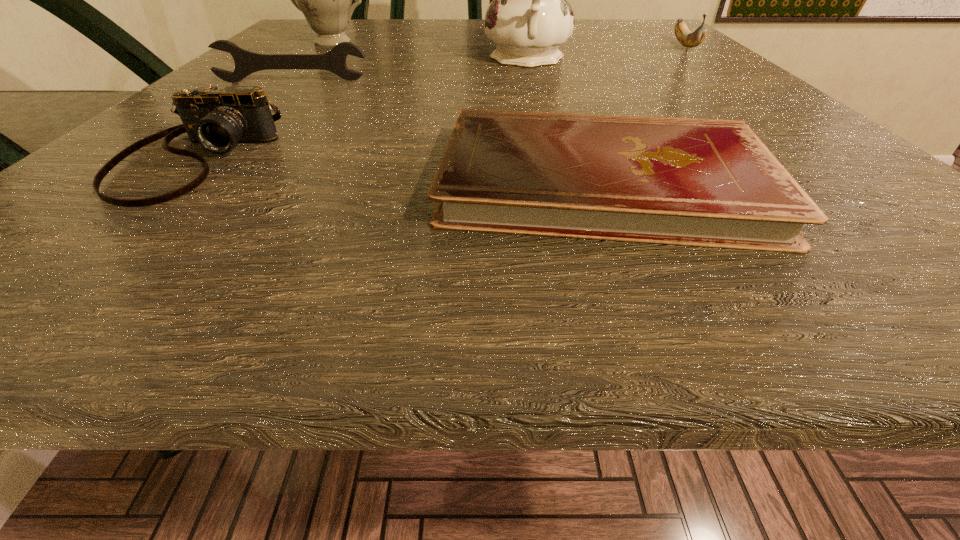
The width and height of the screenshot is (960, 540). Find the location of `vacant area that lies between the rightmost object and the right chinaware`. vacant area that lies between the rightmost object and the right chinaware is located at coordinates (606, 53).

This screenshot has height=540, width=960. In order to click on free space between the shortest object and the banana in this screenshot , I will do `click(644, 114)`.

The image size is (960, 540). I want to click on empty location between the wrench and the rightmost object, so click(x=489, y=64).

Image resolution: width=960 pixels, height=540 pixels. Identify the location of empty space between the camera and the right chinaware. (361, 109).

Image resolution: width=960 pixels, height=540 pixels. In order to click on vacant area that lies between the rightmost object and the wrench in this screenshot , I will do `click(489, 64)`.

At what (x,y) coordinates should I click in order to perform the action: click on free space between the fifth shortest object and the tallest object. Please return your answer as a coordinate pair (x, y). Looking at the image, I should click on (429, 51).

Point out which object is positioned as the second nearest to the shorter chinaware. Please provide its 2D coordinates. Your answer should be formatted as a tuple, i.e. [(x, y)], where the tuple contains the x and y coordinates of a point satisfying the conditions above.

[(529, 18)]

Find the location of `object that can be found as the fifth closest to the shortest object`. object that can be found as the fifth closest to the shortest object is located at coordinates (325, 0).

Where is `vacant area in the image that satisfies the following two spatial constraints: 1. on the spout of the left chinaware; 2. on the left side of the notebook`? vacant area in the image that satisfies the following two spatial constraints: 1. on the spout of the left chinaware; 2. on the left side of the notebook is located at coordinates (193, 181).

This screenshot has height=540, width=960. What are the coordinates of `free spot that satisfies the following two spatial constraints: 1. on the spout of the shorter chinaware; 2. on the left side of the notebook` in the screenshot? It's located at (193, 181).